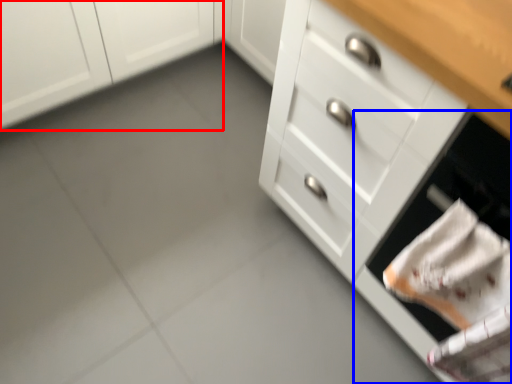
Question: Which point is closer to the camera, cabinetry (highlighted by a red box) or oven (highlighted by a blue box)?

Choices:
 (A) cabinetry
 (B) oven

Answer: (B)